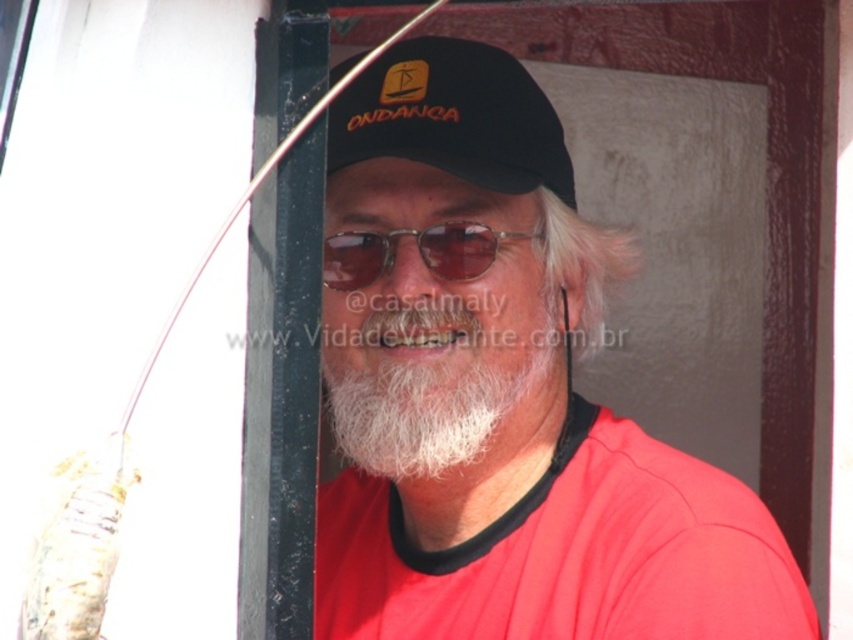
This screenshot has height=640, width=853. What do you see at coordinates (453, 116) in the screenshot?
I see `black matte baseball cap at center` at bounding box center [453, 116].

Who is higher up, black matte baseball cap at center or white soft beard at center?

black matte baseball cap at center is above.

Who is more distant from viewer, (432, 67) or (560, 291)?

Positioned behind is point (560, 291).

Find the location of a particular element. The image size is (853, 640). black matte baseball cap at center is located at coordinates (453, 116).

Is matte black cap at center wider than white soft beard at center?

Yes, matte black cap at center is wider than white soft beard at center.

Consider the image. Can you confirm if matte black cap at center is positioned below white soft beard at center?

No.

Who is more forward, (643,541) or (566,323)?

Point (643,541)

This screenshot has width=853, height=640. In order to click on matte black cap at center in this screenshot , I will do `click(500, 392)`.

Between point (347, 244) and point (569, 336), which one is positioned in front?

Point (347, 244) is more forward.

Describe the element at coordinates (418, 252) in the screenshot. I see `sunglasses at center` at that location.

Which is in front, point (381, 266) or point (570, 368)?

Point (381, 266) is more forward.

At what (x,y) coordinates should I click in order to perform the action: click on sunglasses at center. Please return your answer as a coordinate pair (x, y). Looking at the image, I should click on (418, 252).